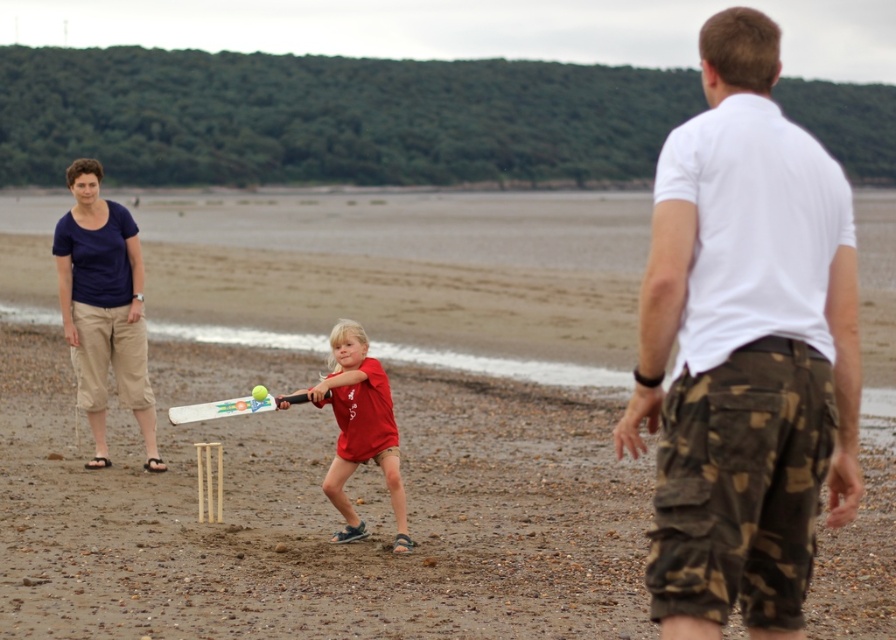
You are a photographer positioned at the edge of the beach scene. You want to capture a photo that includes both the smooth sand at center and the white camo shorts at right. Since you can only focus on one object clearly, which one should you choose to ensure it appears sharp in the photo?

You should focus on the smooth sand at center because it is closer to you than the white camo shorts at right, so focusing on the closer object will keep it sharp while the background may blur.

You are standing at the position of the viewer and want to throw a ball to the adult wearing white camo shorts at right. The maximum distance you can throw is 15 feet. Can you reach them?

The distance between you and the adult wearing white camo shorts at right is 18.18 feet, which exceeds your throwing range of 15 feet. You cannot reach them.